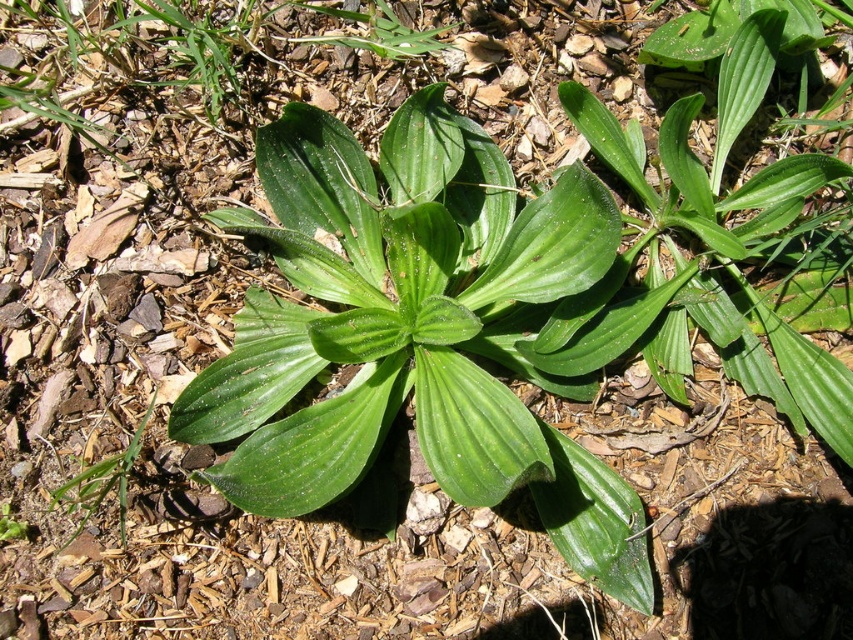
You are standing in a garden and see a point marked at coordinates (x=720, y=248). Based on the scene description, what object does this point correspond to?

The point at coordinates (x=720, y=248) corresponds to the green glossy leaf at center.

You are a gardener trying to identify which part of the plant is the main leaf. You see the green glossy leaf at center and the green leafy plant at lower left. Which one is wider?

The green glossy leaf at center might be wider than the green leafy plant at lower left according to the description.